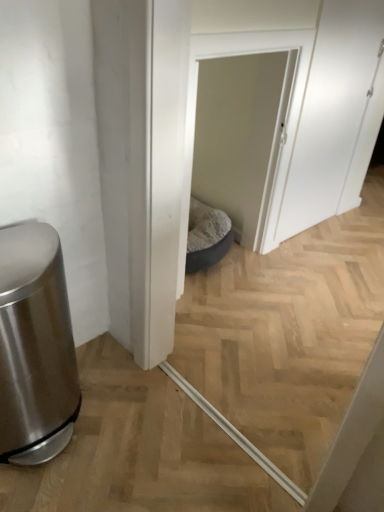
Question: From the image's perspective, is white fabric pet bed at center, the second screen door when ordered from right to left, on top of white matte screen door at upper right, which is the 1th screen door from right to left?

Choices:
 (A) yes
 (B) no

Answer: (B)

Question: Is the depth of white fabric pet bed at center, arranged as the 1th screen door when viewed from the left, less than that of white matte screen door at upper right, which is the 1th screen door from right to left?

Choices:
 (A) yes
 (B) no

Answer: (A)

Question: Is the position of white fabric pet bed at center, the second screen door when ordered from right to left, more distant than that of white matte screen door at upper right, which is the 1th screen door from right to left?

Choices:
 (A) no
 (B) yes

Answer: (A)

Question: From a real-world perspective, is white fabric pet bed at center, arranged as the 1th screen door when viewed from the left, physically above white matte screen door at upper right, which is the 1th screen door from right to left?

Choices:
 (A) yes
 (B) no

Answer: (B)

Question: Does white fabric pet bed at center, the second screen door when ordered from right to left, turn towards white matte screen door at upper right, the second screen door when ordered from left to right?

Choices:
 (A) no
 (B) yes

Answer: (A)

Question: Is white fabric pet bed at center, the second screen door when ordered from right to left, not inside white matte screen door at upper right, which is the 1th screen door from right to left?

Choices:
 (A) no
 (B) yes

Answer: (B)

Question: Can you confirm if white fabric pet bed at center, arranged as the 1th screen door when viewed from the left, is positioned to the right of brushed metal trash can at left?

Choices:
 (A) yes
 (B) no

Answer: (A)

Question: From the image's perspective, would you say white fabric pet bed at center, arranged as the 1th screen door when viewed from the left, is shown under brushed metal trash can at left?

Choices:
 (A) no
 (B) yes

Answer: (A)

Question: Does white fabric pet bed at center, the second screen door when ordered from right to left, have a lesser height compared to brushed metal trash can at left?

Choices:
 (A) no
 (B) yes

Answer: (A)

Question: Can you confirm if white fabric pet bed at center, the second screen door when ordered from right to left, is positioned to the left of brushed metal trash can at left?

Choices:
 (A) no
 (B) yes

Answer: (A)

Question: Is white fabric pet bed at center, the second screen door when ordered from right to left, not near brushed metal trash can at left?

Choices:
 (A) no
 (B) yes

Answer: (B)

Question: Can you confirm if white fabric pet bed at center, the second screen door when ordered from right to left, is bigger than brushed metal trash can at left?

Choices:
 (A) no
 (B) yes

Answer: (A)

Question: Would you consider brushed metal trash can at left to be distant from white matte screen door at upper right, which is the 1th screen door from right to left?

Choices:
 (A) no
 (B) yes

Answer: (B)